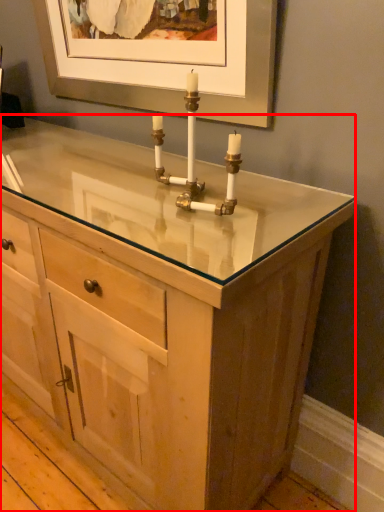
Question: In this image, where is chest of drawers (annotated by the red box) located relative to candle holder?

Choices:
 (A) left
 (B) right

Answer: (A)